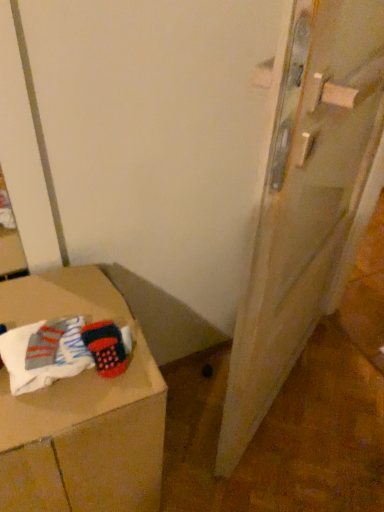
Question: Is there a large distance between wooden door at right and cardboard box at lower left?

Choices:
 (A) yes
 (B) no

Answer: (B)

Question: Considering the relative sizes of wooden door at right and cardboard box at lower left in the image provided, is wooden door at right bigger than cardboard box at lower left?

Choices:
 (A) yes
 (B) no

Answer: (A)

Question: From a real-world perspective, is wooden door at right on cardboard box at lower left?

Choices:
 (A) yes
 (B) no

Answer: (A)

Question: Can you see wooden door at right touching cardboard box at lower left?

Choices:
 (A) yes
 (B) no

Answer: (B)

Question: Is wooden door at right oriented away from cardboard box at lower left?

Choices:
 (A) no
 (B) yes

Answer: (A)

Question: Is point (226, 466) closer or farther from the camera than point (36, 361)?

Choices:
 (A) farther
 (B) closer

Answer: (A)

Question: Which is correct: wooden door at right is inside white cotton socks at lower left, or outside of it?

Choices:
 (A) inside
 (B) outside

Answer: (B)

Question: From a real-world perspective, is wooden door at right positioned above or below white cotton socks at lower left?

Choices:
 (A) above
 (B) below

Answer: (B)

Question: Considering the positions of wooden door at right and white cotton socks at lower left in the image, is wooden door at right bigger or smaller than white cotton socks at lower left?

Choices:
 (A) big
 (B) small

Answer: (A)

Question: Considering the positions of wooden door at right and cardboard box at lower left in the image, is wooden door at right wider or thinner than cardboard box at lower left?

Choices:
 (A) thin
 (B) wide

Answer: (A)

Question: From the image's perspective, is wooden door at right located above or below cardboard box at lower left?

Choices:
 (A) above
 (B) below

Answer: (A)

Question: Is wooden door at right in front of or behind cardboard box at lower left in the image?

Choices:
 (A) behind
 (B) front

Answer: (B)

Question: From a real-world perspective, is wooden door at right above or below cardboard box at lower left?

Choices:
 (A) above
 (B) below

Answer: (A)

Question: In the image, is cardboard box at lower left on the left side or the right side of wooden door at right?

Choices:
 (A) right
 (B) left

Answer: (B)

Question: From a real-world perspective, is cardboard box at lower left positioned above or below wooden door at right?

Choices:
 (A) above
 (B) below

Answer: (B)